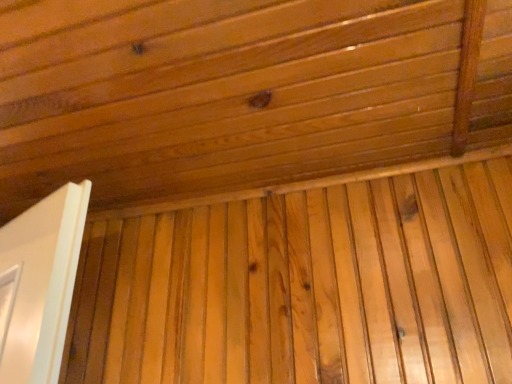
This screenshot has width=512, height=384. Describe the element at coordinates (241, 92) in the screenshot. I see `natural wood ceiling at upper center` at that location.

This screenshot has height=384, width=512. I want to click on natural wood ceiling at upper center, so click(241, 92).

I want to click on natural wood plywood at center, so click(305, 287).

This screenshot has height=384, width=512. Describe the element at coordinates (305, 287) in the screenshot. I see `natural wood plywood at center` at that location.

Locate an element on the screen. natural wood ceiling at upper center is located at coordinates (241, 92).

Which is more to the left, natural wood plywood at center or natural wood ceiling at upper center?

Positioned to the left is natural wood ceiling at upper center.

Which object is closer to the camera, natural wood plywood at center or natural wood ceiling at upper center?

natural wood ceiling at upper center is closer to the camera.

Between point (177, 231) and point (300, 19), which one is positioned in front?

Point (300, 19)

From the image's perspective, is natural wood plywood at center located above or below natural wood ceiling at upper center?

Clearly, from the image's perspective, natural wood plywood at center is below natural wood ceiling at upper center.

Consider the image. From a real-world perspective, between natural wood plywood at center and natural wood ceiling at upper center, who is vertically lower?

natural wood plywood at center is physically lower.

Is natural wood plywood at center wider than natural wood ceiling at upper center?

No.

Can you confirm if natural wood plywood at center is shorter than natural wood ceiling at upper center?

No, natural wood plywood at center is not shorter than natural wood ceiling at upper center.

Based on their sizes in the image, would you say natural wood plywood at center is bigger or smaller than natural wood ceiling at upper center?

Considering their sizes, natural wood plywood at center takes up less space than natural wood ceiling at upper center.

Would you say natural wood plywood at center is inside or outside natural wood ceiling at upper center?

natural wood plywood at center is located beyond the bounds of natural wood ceiling at upper center.

Is natural wood plywood at center placed right next to natural wood ceiling at upper center?

No.

Could you tell me if natural wood plywood at center is turned towards natural wood ceiling at upper center?

Yes, natural wood plywood at center is turned towards natural wood ceiling at upper center.

This screenshot has width=512, height=384. In order to click on plywood behind the natural wood ceiling at upper center in this screenshot , I will do `click(305, 287)`.

Between natural wood ceiling at upper center and natural wood plywood at center, which one appears on the right side from the viewer's perspective?

Positioned to the right is natural wood plywood at center.

Is natural wood ceiling at upper center closer to the viewer compared to natural wood plywood at center?

Yes, natural wood ceiling at upper center is closer to the camera.

Does point (336, 113) come behind point (160, 343)?

No, it is in front of (160, 343).

From the image's perspective, does natural wood ceiling at upper center appear lower than natural wood plywood at center?

Incorrect, from the image's perspective, natural wood ceiling at upper center is higher than natural wood plywood at center.

From a real-world perspective, is natural wood ceiling at upper center under natural wood plywood at center?

No, from a real-world perspective, natural wood ceiling at upper center is not below natural wood plywood at center.

Does natural wood ceiling at upper center have a lesser width compared to natural wood plywood at center?

No.

Considering the sizes of natural wood ceiling at upper center and natural wood plywood at center in the image, is natural wood ceiling at upper center taller or shorter than natural wood plywood at center?

Clearly, natural wood ceiling at upper center is shorter compared to natural wood plywood at center.

Who is smaller, natural wood ceiling at upper center or natural wood plywood at center?

Smaller between the two is natural wood plywood at center.

Would you say natural wood ceiling at upper center is outside natural wood plywood at center?

Yes, natural wood ceiling at upper center is outside of natural wood plywood at center.

Are natural wood ceiling at upper center and natural wood plywood at center making contact?

No, natural wood ceiling at upper center is not next to natural wood plywood at center.

Is natural wood ceiling at upper center aimed at natural wood plywood at center?

No.

How different are the orientations of natural wood ceiling at upper center and natural wood plywood at center in degrees?

There is a 89.4-degree angle between the facing directions of natural wood ceiling at upper center and natural wood plywood at center.

Measure the distance from natural wood ceiling at upper center to natural wood plywood at center.

natural wood ceiling at upper center and natural wood plywood at center are 30.54 centimeters apart from each other.

In the image, there is a natural wood ceiling at upper center. At what (x,y) coordinates should I click in order to perform the action: click on plywood below it (from the image's perspective). Please return your answer as a coordinate pair (x, y). Image resolution: width=512 pixels, height=384 pixels. Looking at the image, I should click on (305, 287).

Identify the location of plywood located on the right of natural wood ceiling at upper center. (305, 287).

The width and height of the screenshot is (512, 384). In the image, there is a natural wood ceiling at upper center. What are the coordinates of `plywood below it (from the image's perspective)` in the screenshot? It's located at (305, 287).